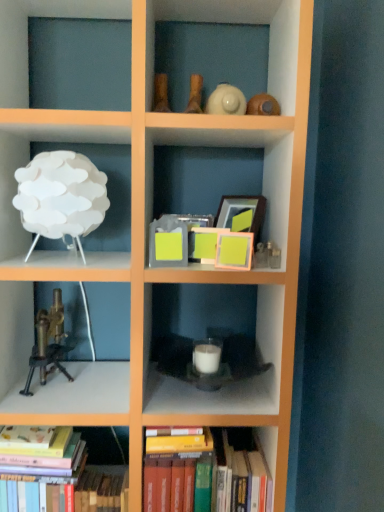
Question: Is hardcover books at center, positioned as the 1th book in right-to-left order, positioned behind brass/bronze microscope at left?

Choices:
 (A) yes
 (B) no

Answer: (B)

Question: Is hardcover books at center, the second book viewed from the left, surrounding brass/bronze microscope at left?

Choices:
 (A) no
 (B) yes

Answer: (A)

Question: Does hardcover books at center, positioned as the 1th book in right-to-left order, have a greater width compared to brass/bronze microscope at left?

Choices:
 (A) no
 (B) yes

Answer: (B)

Question: Does hardcover books at center, positioned as the 1th book in right-to-left order, have a greater height compared to brass/bronze microscope at left?

Choices:
 (A) yes
 (B) no

Answer: (A)

Question: From the image's perspective, is hardcover books at center, positioned as the 1th book in right-to-left order, under brass/bronze microscope at left?

Choices:
 (A) no
 (B) yes

Answer: (B)

Question: Are hardcover books at center, positioned as the 1th book in right-to-left order, and brass/bronze microscope at left far apart?

Choices:
 (A) yes
 (B) no

Answer: (B)

Question: Can you confirm if hardcover books at lower left, acting as the 2th book starting from the right, is shorter than white matte lamp at upper left, arranged as the first shelf when viewed from the top?

Choices:
 (A) no
 (B) yes

Answer: (A)

Question: Is hardcover books at lower left, positioned as the first book in left-to-right order, surrounding white matte lamp at upper left, placed as the second shelf when sorted from bottom to top?

Choices:
 (A) no
 (B) yes

Answer: (A)

Question: Is hardcover books at lower left, acting as the 2th book starting from the right, next to white matte lamp at upper left, which is the 2th shelf in right-to-left order?

Choices:
 (A) yes
 (B) no

Answer: (B)

Question: Does hardcover books at lower left, positioned as the first book in left-to-right order, have a greater width compared to white matte lamp at upper left, arranged as the first shelf when viewed from the top?

Choices:
 (A) no
 (B) yes

Answer: (A)

Question: From the image's perspective, is hardcover books at lower left, acting as the 2th book starting from the right, beneath white matte lamp at upper left, placed as the second shelf when sorted from bottom to top?

Choices:
 (A) yes
 (B) no

Answer: (A)

Question: From a real-world perspective, is hardcover books at lower left, positioned as the first book in left-to-right order, located beneath white matte lamp at upper left, which ranks as the 1th shelf in left-to-right order?

Choices:
 (A) no
 (B) yes

Answer: (B)

Question: Considering the relative positions of brass/bronze microscope at left and white matte candle at center, the second shelf when ordered from left to right, in the image provided, is brass/bronze microscope at left to the left of white matte candle at center, the second shelf when ordered from left to right, from the viewer's perspective?

Choices:
 (A) no
 (B) yes

Answer: (B)